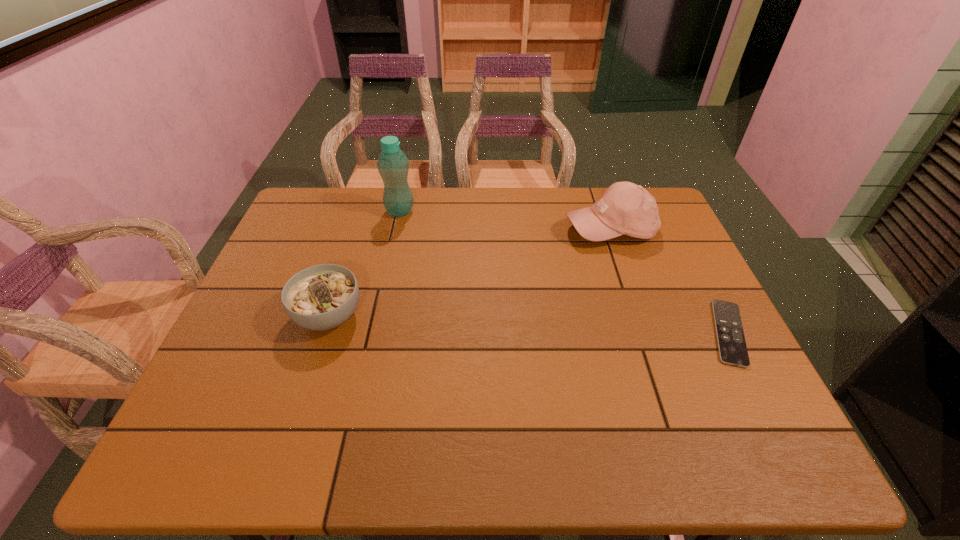
This screenshot has width=960, height=540. I want to click on blank area located on the front-facing side of the second tallest object, so click(595, 263).

Find the location of a particular element. The image size is (960, 540). vacant space located 0.080m at the front cap of the water bottle is located at coordinates (422, 230).

Where is `free region located 0.340m at the front cap of the water bottle`? free region located 0.340m at the front cap of the water bottle is located at coordinates (476, 275).

The image size is (960, 540). What are the coordinates of `vacant space located 0.110m at the front cap of the water bottle` in the screenshot? It's located at (428, 235).

Where is `baseball cap that is at the far edge`? The height and width of the screenshot is (540, 960). baseball cap that is at the far edge is located at coordinates (625, 208).

Identify the location of water bottle that is at the far edge. The image size is (960, 540). (393, 165).

Image resolution: width=960 pixels, height=540 pixels. What are the coordinates of `object present at the left edge` in the screenshot? It's located at (321, 297).

Locate an element on the screen. This screenshot has height=540, width=960. remote control located at the right edge is located at coordinates (732, 347).

Identify the location of baseball cap positioned at the right edge. (625, 208).

The width and height of the screenshot is (960, 540). In order to click on object at the far right corner in this screenshot , I will do `click(625, 208)`.